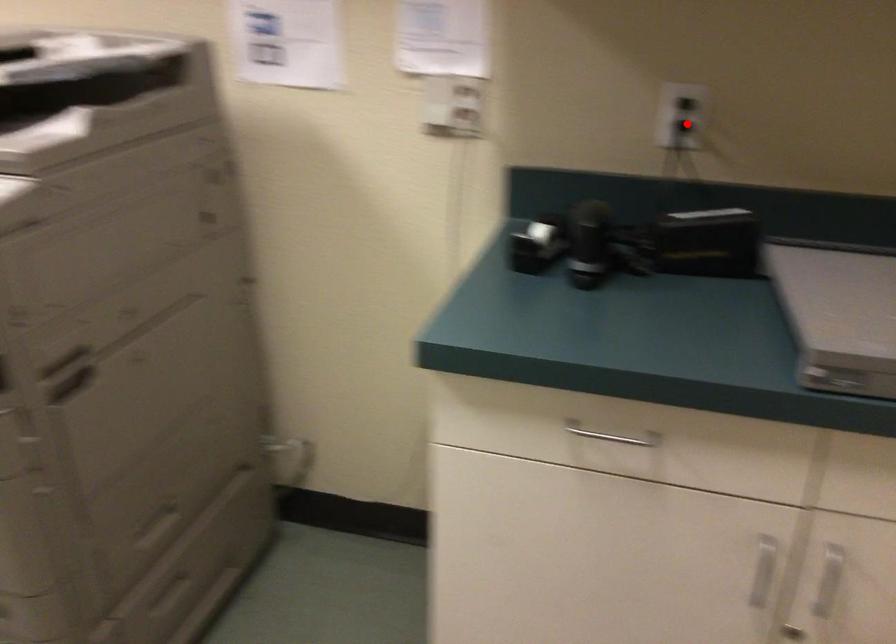
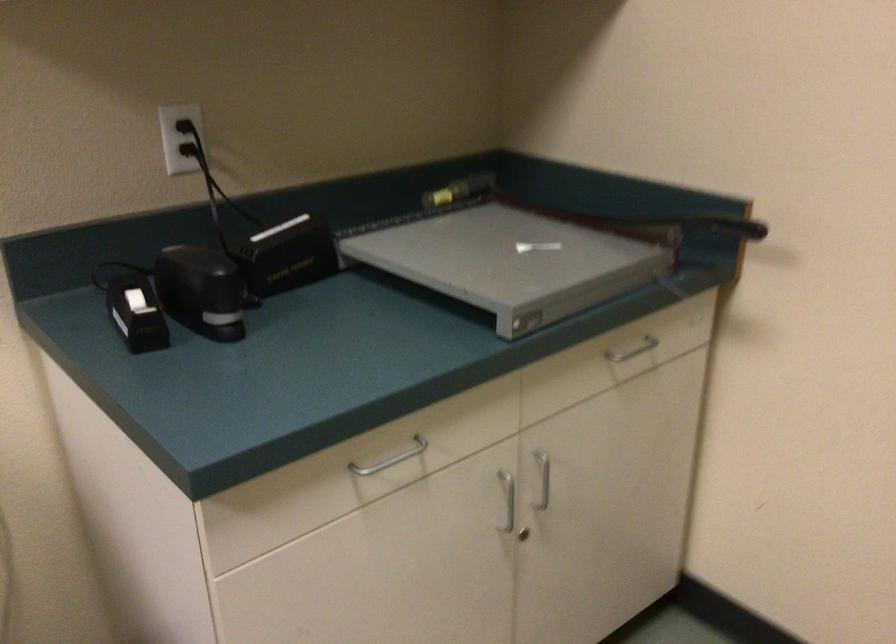
Find the pixel in the second image that matches the highlighted location in the first image.

(192, 149)